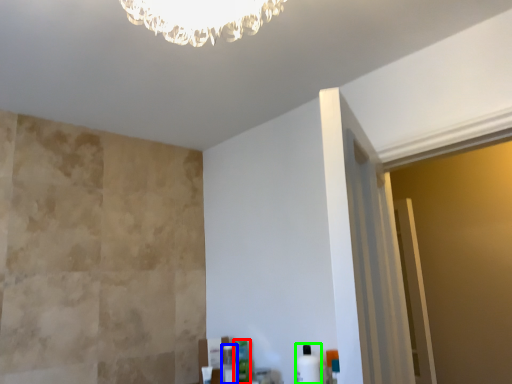
Question: Which object is positioned farthest from toiletry (highlighted by a red box)? Select from toiletry (highlighted by a blue box) and toiletry (highlighted by a green box).

Choices:
 (A) toiletry
 (B) toiletry

Answer: (B)